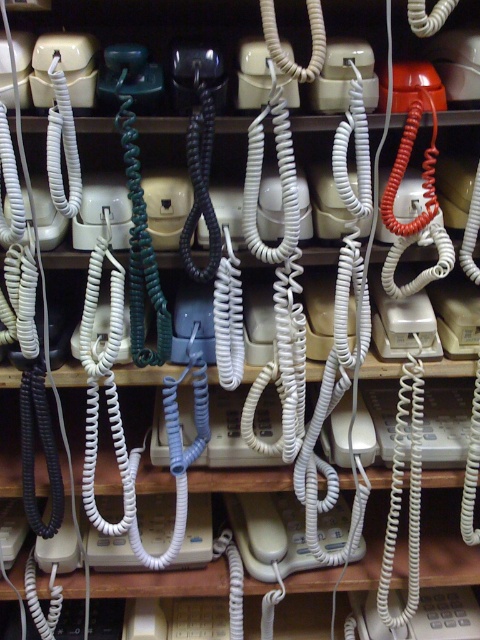
Question: Does white matte phone at center appear on the left side of white matte telephone at center?

Choices:
 (A) yes
 (B) no

Answer: (A)

Question: Which object is farther from the camera taking this photo?

Choices:
 (A) white matte phone at center
 (B) white matte telephone at center

Answer: (B)

Question: Does white matte phone at center have a lesser width compared to white matte telephone at center?

Choices:
 (A) no
 (B) yes

Answer: (A)

Question: Does white matte phone at center have a greater width compared to white matte telephone at center?

Choices:
 (A) yes
 (B) no

Answer: (A)